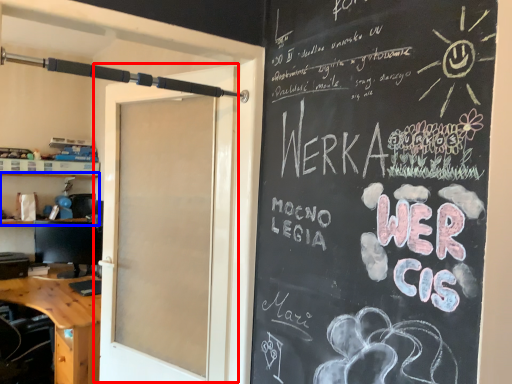
Question: Which object is further to the camera taking this photo, door (highlighted by a red box) or shelf (highlighted by a blue box)?

Choices:
 (A) door
 (B) shelf

Answer: (B)